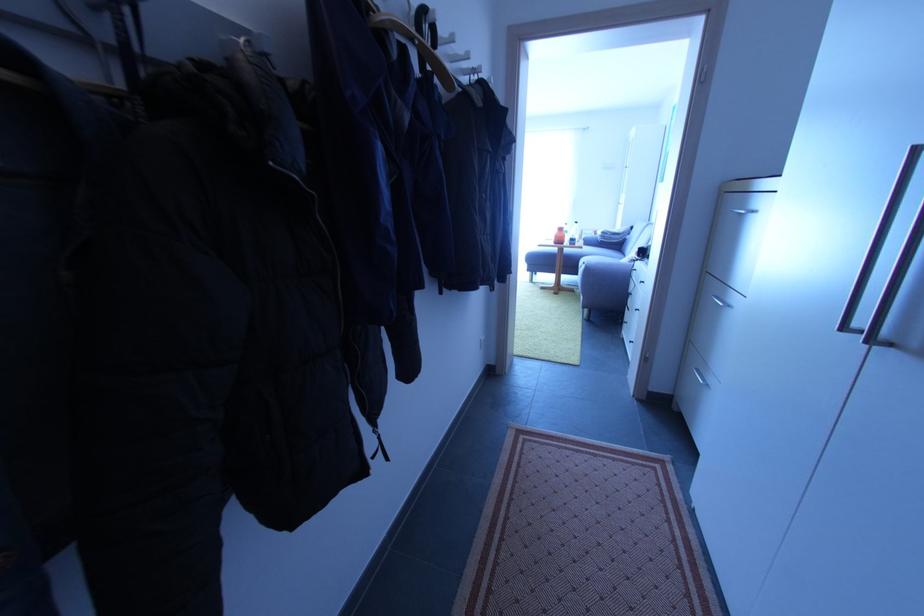
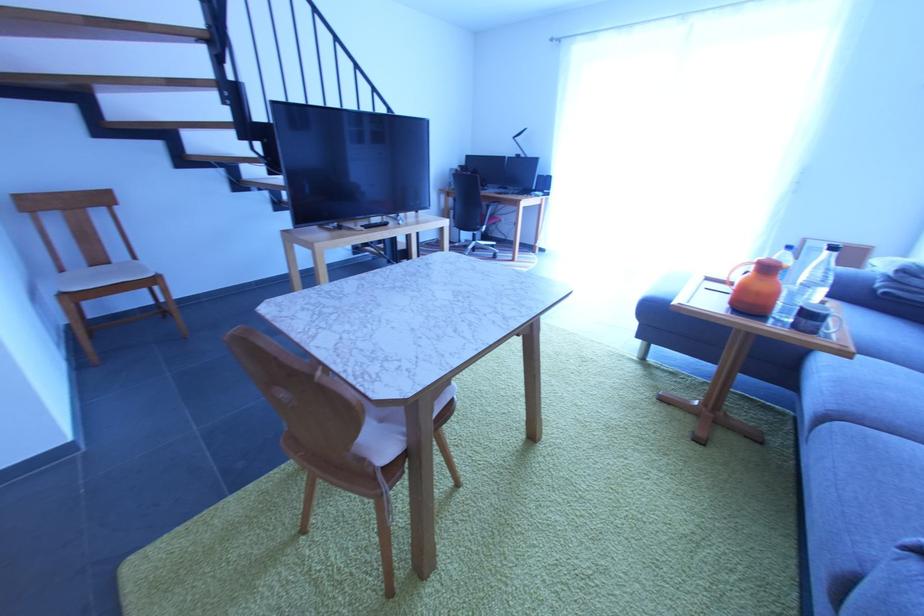
Question: In a continuous first-person perspective shot, in which direction is the camera moving?

Choices:
 (A) Left
 (B) Right
 (C) Forward
 (D) Backward

Answer: (C)